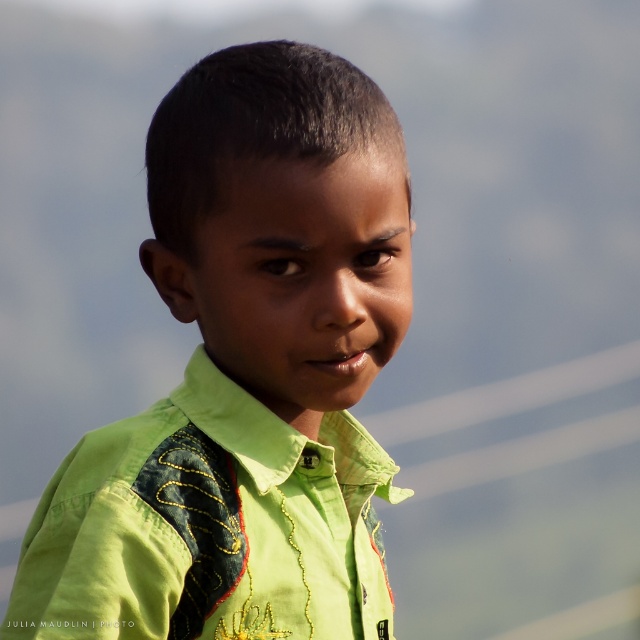
Does green fabric shirt at center have a lesser height compared to green embroidered shirt at center?

No, green fabric shirt at center is not shorter than green embroidered shirt at center.

Does green fabric shirt at center come behind green embroidered shirt at center?

Yes.

Does point (321, 392) come behind point (324, 554)?

No, it is in front of (324, 554).

What are the coordinates of `green fabric shirt at center` in the screenshot? It's located at (244, 374).